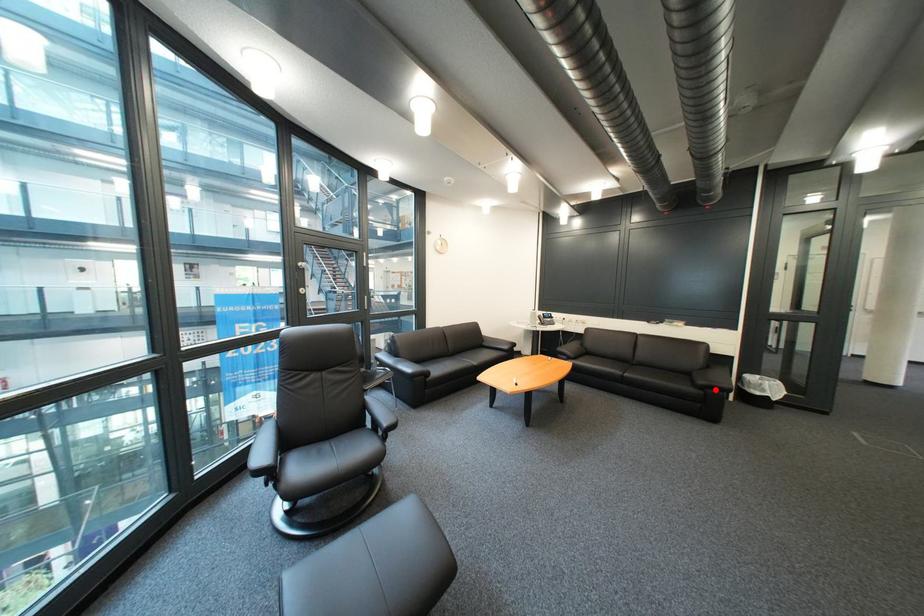
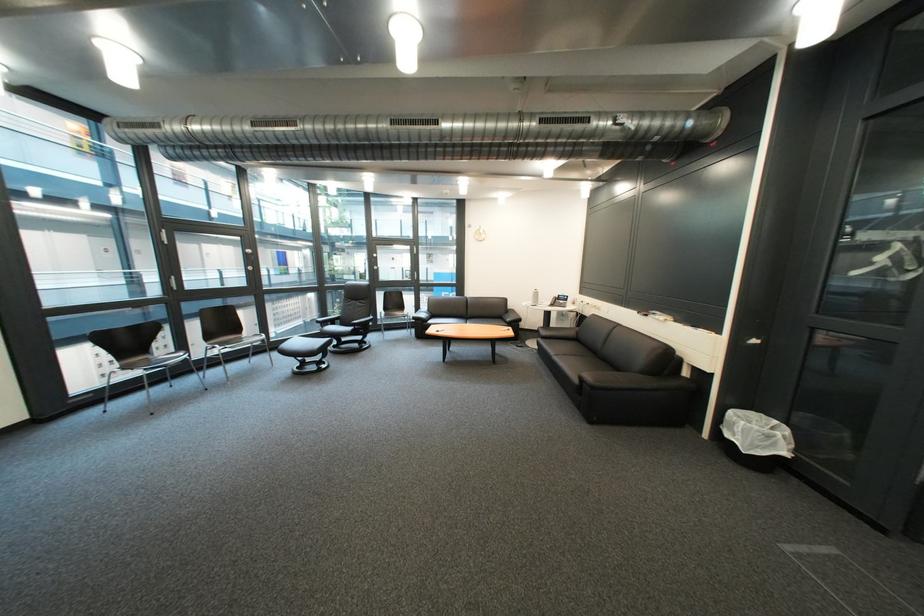
Question: I am providing you with two images of the same scene from different viewpoints. A red point is shown in image1. For the corresponding object point in image2, is it positioned nearer or farther from the camera?

Choices:
 (A) Nearer
 (B) Farther

Answer: (A)